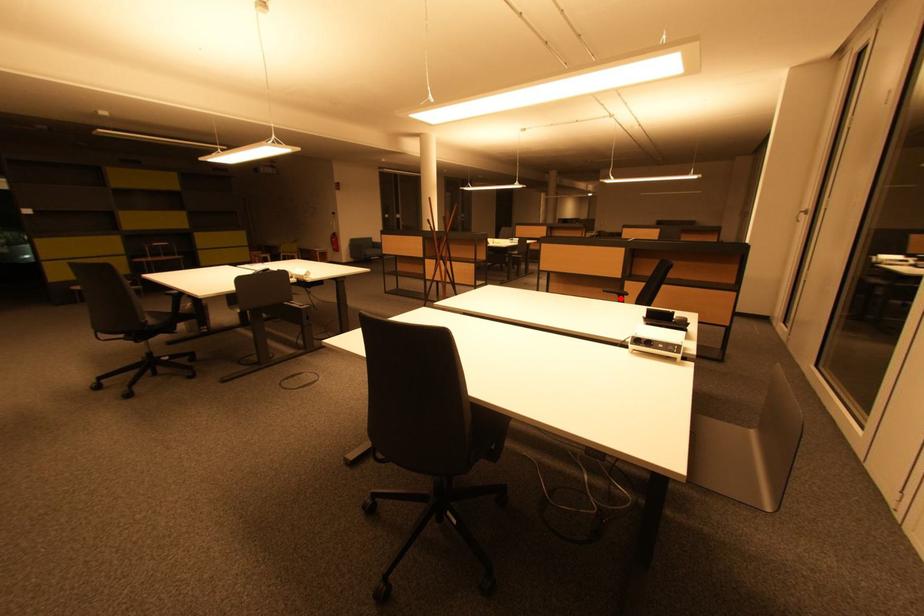
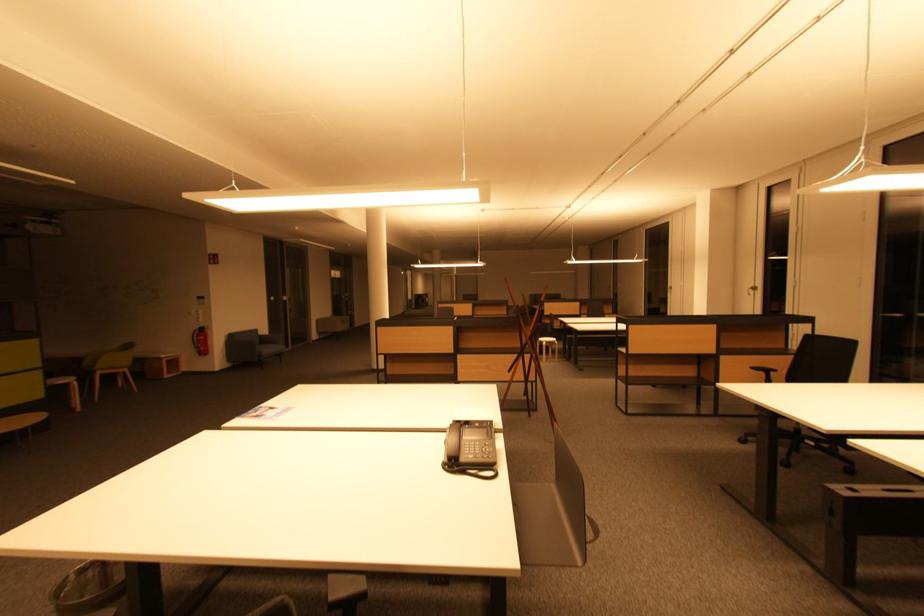
In the second image, find the point that corresponds to the highlighted location in the first image.

(767, 376)